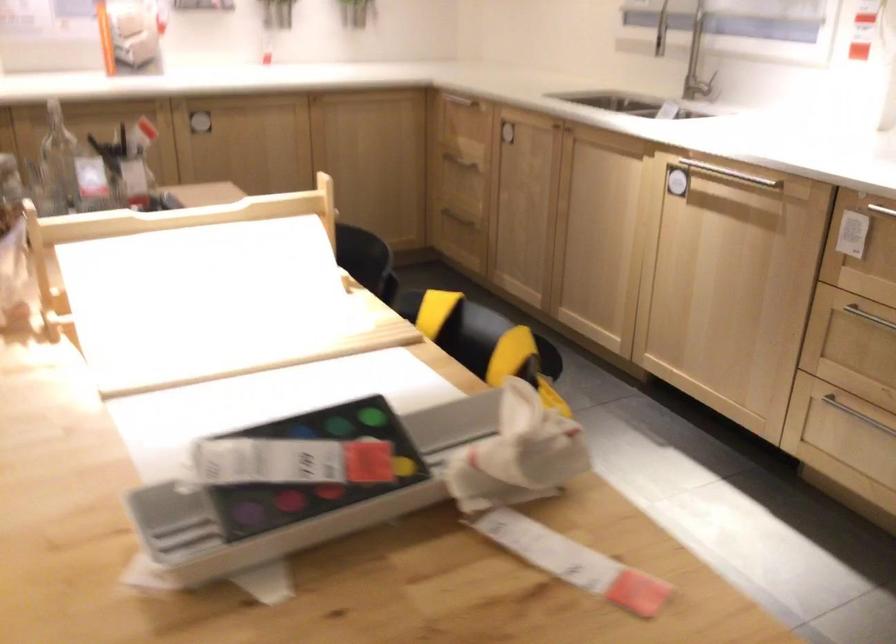
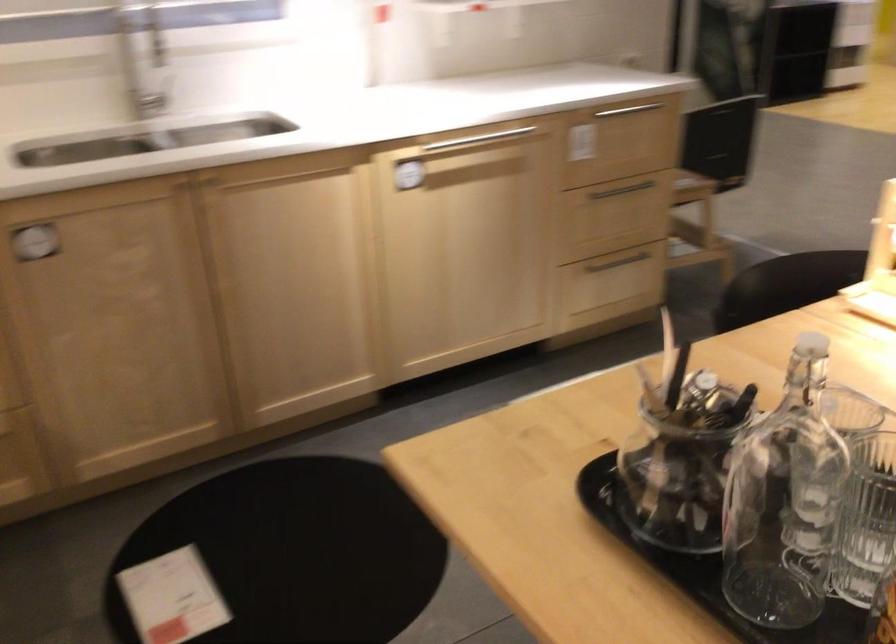
Find the pixel in the second image that matches the point at 720,169 in the first image.

(472, 140)